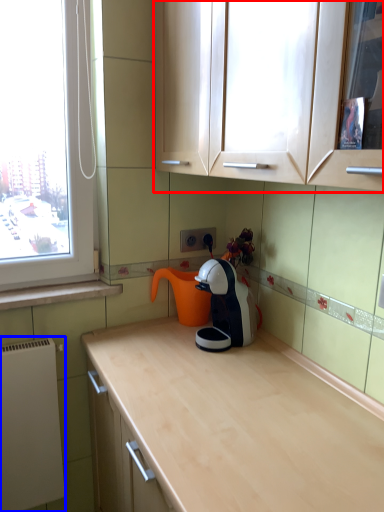
Question: Which of the following is the closest to the observer, cabinetry (highlighted by a red box) or appliance (highlighted by a blue box)?

Choices:
 (A) cabinetry
 (B) appliance

Answer: (A)